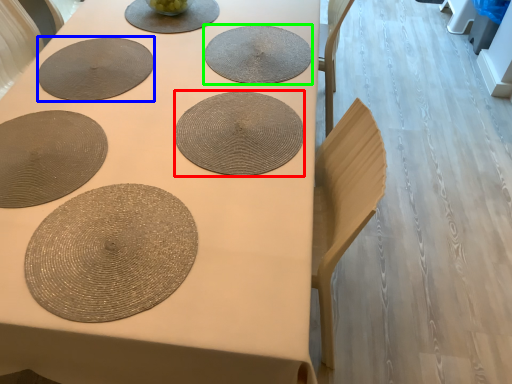
Question: Based on their relative distances, which object is farther from coaster (highlighted by a red box)? Choose from paper plate (highlighted by a blue box) and coaster (highlighted by a green box).

Choices:
 (A) paper plate
 (B) coaster

Answer: (A)